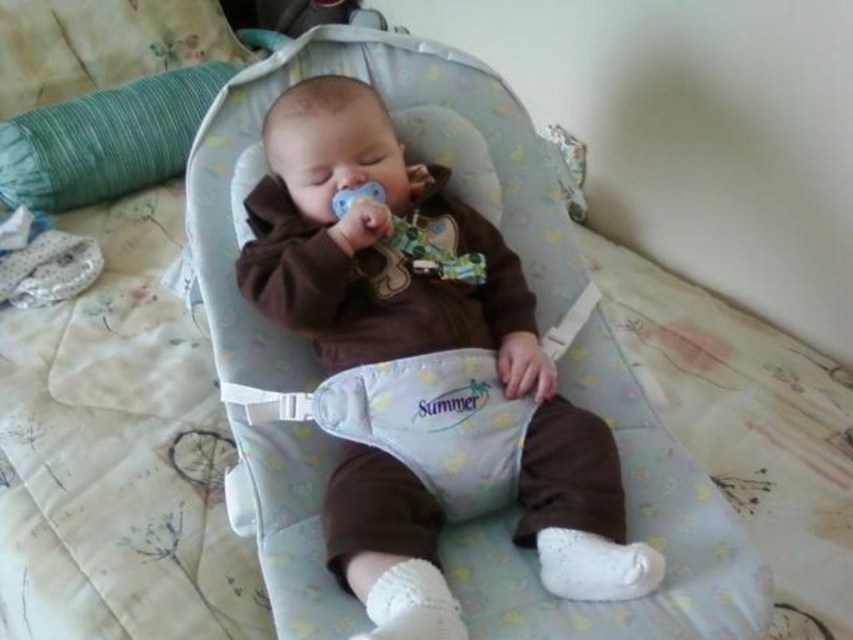
Based on the photo, which is above, matte brown baby at center or green fabric pillow at upper left?

green fabric pillow at upper left is higher up.

Does point (469, 214) come behind point (113, 173)?

No, it is not.

Locate an element on the screen. matte brown baby at center is located at coordinates (422, 371).